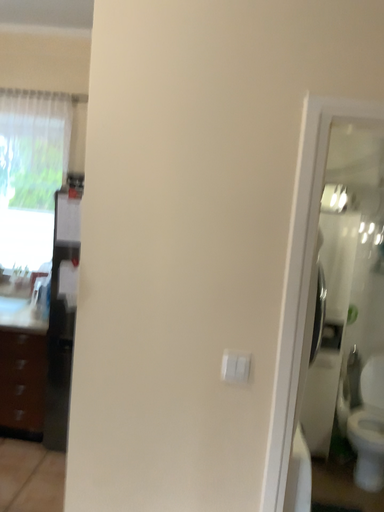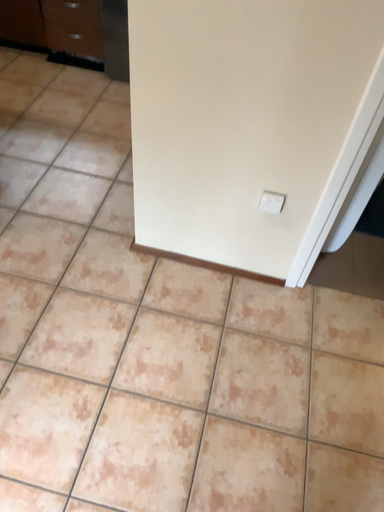
Question: Which way did the camera rotate in the video?

Choices:
 (A) rotated upward
 (B) rotated downward

Answer: (B)